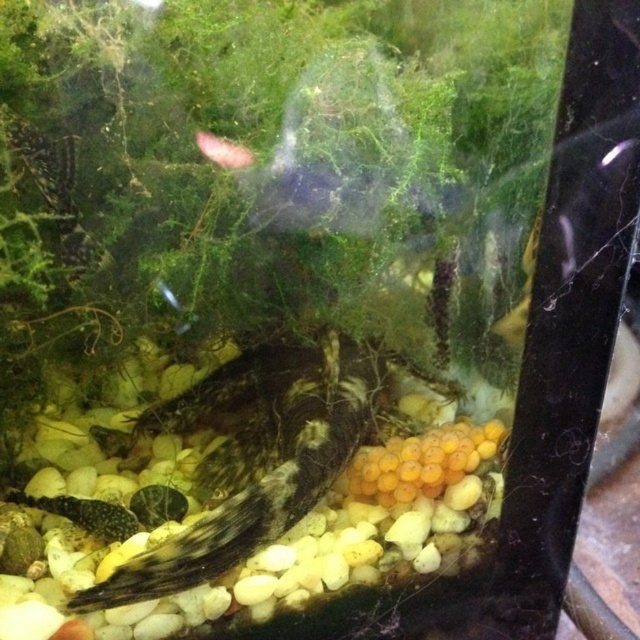
You are an aquatic enthusiast observing the fish tank. You notice two fish species inside. Which fish is larger in size between the speckled brown fish at center and the pink translucent fish at upper center?

The speckled brown fish at center is bigger than the pink translucent fish at upper center.

You are a new fish in the tank and want to swim to the pink translucent fish at upper center. Which direction should you swim to avoid the speckled brown fish at center?

To avoid the speckled brown fish at center, you should swim behind it since the speckled brown fish at center is in front of the pink translucent fish at upper center, meaning the pink translucent fish is located behind the speckled brown fish at center.

You are an aquatic biologist observing the fish tank. You notice the speckled brown fish at center and the pink translucent fish at upper center. Which fish is located lower in the tank?

The speckled brown fish at center is positioned under the pink translucent fish at upper center, so it is located lower in the tank.